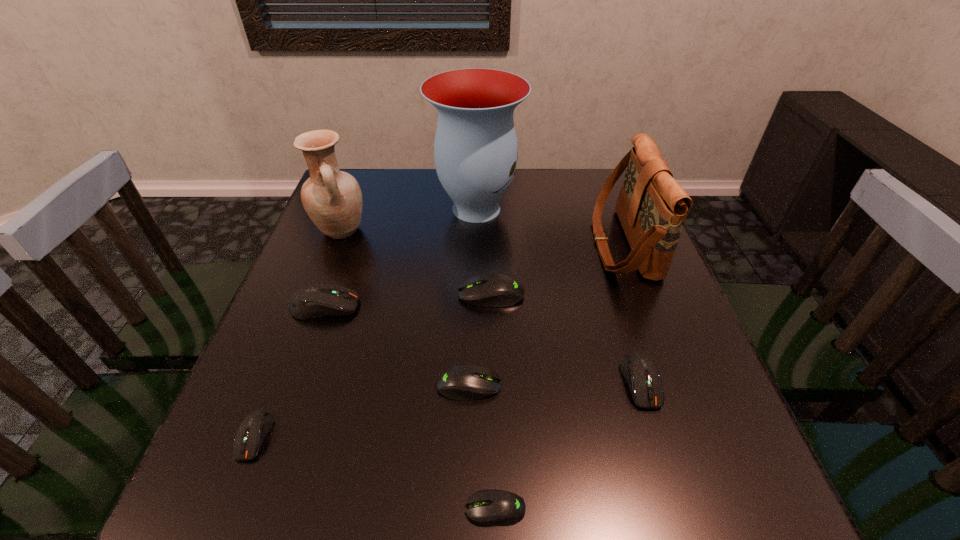
The image size is (960, 540). Find the location of `the eighth farthest object`. the eighth farthest object is located at coordinates coord(252,431).

Image resolution: width=960 pixels, height=540 pixels. I want to click on the nearest object, so click(493, 507).

Locate an element on the screen. This screenshot has width=960, height=540. the smallest gray computer mouse is located at coordinates (493, 507).

Identify the location of vacant area located 0.210m on the front of the tallest object. The height and width of the screenshot is (540, 960). (475, 294).

Identify the location of vacant space situated on the front of the pink pottery. The width and height of the screenshot is (960, 540). (328, 265).

This screenshot has width=960, height=540. I want to click on vacant space situated 0.270m on the front-facing side of the shoulder bag, so pyautogui.click(x=489, y=244).

At what (x,y) coordinates should I click in order to perform the action: click on free space located on the front-facing side of the shoulder bag. Please return your answer as a coordinate pair (x, y). Looking at the image, I should click on coord(492,244).

Locate an element on the screen. The height and width of the screenshot is (540, 960). free spot located 0.390m on the front-facing side of the shoulder bag is located at coordinates (442, 244).

You are a GUI agent. You are given a task and a screenshot of the screen. Output one action in this format:
    pyautogui.click(x=<x>, y=<y>)
    Task: Click on the vacant area situated on the button of the farthest dark computer equipment
    The image size is (960, 540).
    Given the screenshot: What is the action you would take?
    pyautogui.click(x=432, y=306)

Where is `free region located 0.060m on the wheel side of the biggest gray computer mouse`? free region located 0.060m on the wheel side of the biggest gray computer mouse is located at coordinates (431, 295).